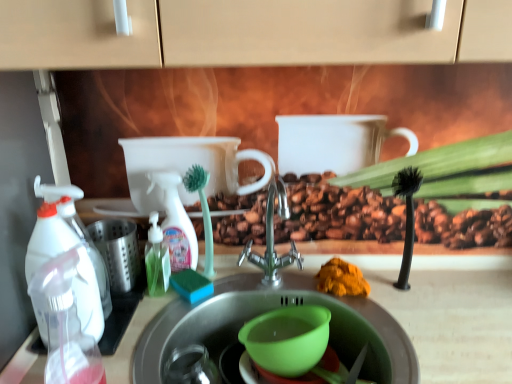
Question: From the image's perspective, is translucent plastic bottle at center-left, which appears as the 2th bottle when viewed from the left, on top of transparent plastic spray bottle at left, the second bottle viewed from the right?

Choices:
 (A) yes
 (B) no

Answer: (A)

Question: Does translucent plastic bottle at center-left, positioned as the 2th bottle in front-to-back order, have a smaller size compared to transparent plastic spray bottle at left, the second bottle viewed from the right?

Choices:
 (A) yes
 (B) no

Answer: (A)

Question: Is translucent plastic bottle at center-left, which appears as the 2th bottle when viewed from the left, further to camera compared to transparent plastic spray bottle at left, the second bottle viewed from the right?

Choices:
 (A) no
 (B) yes

Answer: (B)

Question: Is transparent plastic spray bottle at left, the 1th bottle when ordered from front to back, surrounded by translucent plastic bottle at center-left, which appears as the 2th bottle when viewed from the left?

Choices:
 (A) yes
 (B) no

Answer: (B)

Question: Is translucent plastic bottle at center-left, marked as the 1th bottle in a right-to-left arrangement, positioned in front of transparent plastic spray bottle at left, the second bottle viewed from the right?

Choices:
 (A) no
 (B) yes

Answer: (A)

Question: Relative to white plastic spray bottle at center, the 1th cleaning product in the right-to-left sequence, is transparent plastic spray bottle at left, the 1th bottle when ordered from front to back, in front or behind?

Choices:
 (A) front
 (B) behind

Answer: (A)

Question: Is transparent plastic spray bottle at left, the 1th bottle when ordered from front to back, inside or outside of white plastic spray bottle at center, the second cleaning product positioned from the front?

Choices:
 (A) outside
 (B) inside

Answer: (A)

Question: Considering the relative positions of transparent plastic spray bottle at left, positioned as the 1th bottle in left-to-right order, and white plastic spray bottle at center, the second cleaning product positioned from the front, in the image provided, is transparent plastic spray bottle at left, positioned as the 1th bottle in left-to-right order, to the left or to the right of white plastic spray bottle at center, the second cleaning product positioned from the front,?

Choices:
 (A) right
 (B) left

Answer: (B)

Question: In terms of width, does transparent plastic spray bottle at left, the 2th bottle from the back, look wider or thinner when compared to white plastic spray bottle at center, the 1th cleaning product in the right-to-left sequence?

Choices:
 (A) thin
 (B) wide

Answer: (B)

Question: Which is correct: orange powder at sink is inside green plastic mixing bowl at sink, or outside of it?

Choices:
 (A) inside
 (B) outside

Answer: (B)

Question: Is orange powder at sink to the left or to the right of green plastic mixing bowl at sink in the image?

Choices:
 (A) right
 (B) left

Answer: (A)

Question: From a real-world perspective, is orange powder at sink positioned above or below green plastic mixing bowl at sink?

Choices:
 (A) above
 (B) below

Answer: (A)

Question: Is point (335, 271) closer or farther from the camera than point (300, 347)?

Choices:
 (A) farther
 (B) closer

Answer: (A)

Question: From a real-world perspective, is translucent plastic bottle at center-left, marked as the 1th bottle in a right-to-left arrangement, above or below orange powder at sink?

Choices:
 (A) above
 (B) below

Answer: (A)

Question: Visually, is translucent plastic bottle at center-left, marked as the 1th bottle in a right-to-left arrangement, positioned to the left or to the right of orange powder at sink?

Choices:
 (A) left
 (B) right

Answer: (A)